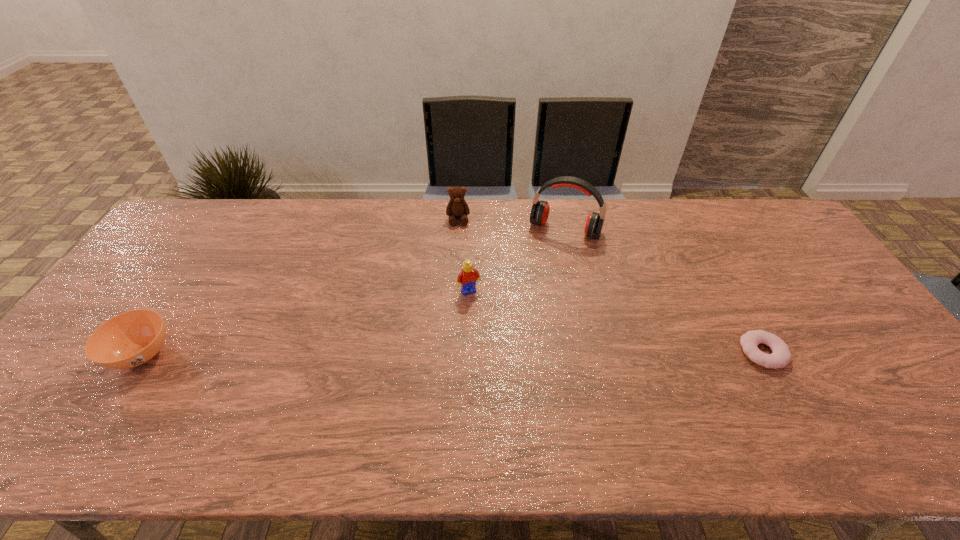
Identify the location of the leftmost object. The width and height of the screenshot is (960, 540). (130, 339).

Where is `soup bowl`? soup bowl is located at coordinates (130, 339).

Identify the location of the shortest object. (780, 357).

Locate an element on the screen. This screenshot has width=960, height=540. doughnut is located at coordinates (780, 357).

At what (x,y) coordinates should I click in order to perform the action: click on teddy bear. Please return your answer as a coordinate pair (x, y). Image resolution: width=960 pixels, height=540 pixels. Looking at the image, I should click on (457, 207).

Locate an element on the screen. This screenshot has width=960, height=540. the third farthest object is located at coordinates [x=467, y=278].

Locate an element on the screen. earphone is located at coordinates (539, 214).

What are the coordinates of `the second object from right to left` in the screenshot? It's located at (539, 214).

Identify the location of vacant space located on the back of the second shortest object. This screenshot has width=960, height=540. (202, 263).

In order to click on vacant region located on the back of the doughnut in this screenshot , I will do `click(701, 240)`.